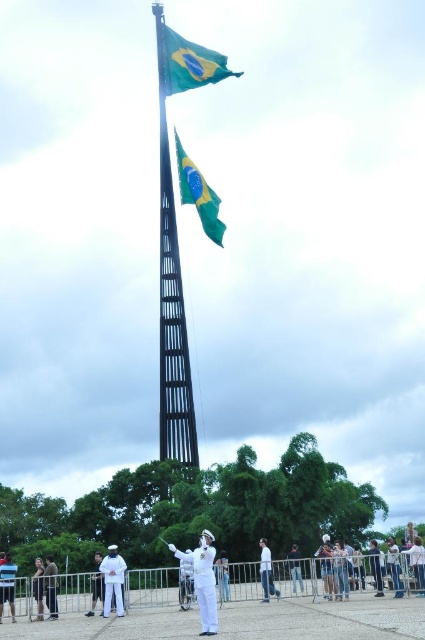
Question: Is white matte uniform at center above white cotton shirt at lower center?

Choices:
 (A) yes
 (B) no

Answer: (B)

Question: From the image, what is the correct spatial relationship of white uniform pants at lower left in relation to dark blue uniform at lower left?

Choices:
 (A) left
 (B) right

Answer: (A)

Question: Which of the following is the farthest from the observer?

Choices:
 (A) (178, 252)
 (B) (297, 580)

Answer: (A)

Question: Which point is closer to the camera?

Choices:
 (A) dark blue uniform at lower left
 (B) green and yellow fabric flag at upper center
 (C) green fabric flag at upper center

Answer: (A)

Question: Is white uniform pants at lower left to the left of dark gray uniform at lower left from the viewer's perspective?

Choices:
 (A) no
 (B) yes

Answer: (B)

Question: Which point appears closest to the camera in this image?

Choices:
 (A) (212, 564)
 (B) (175, 76)

Answer: (A)